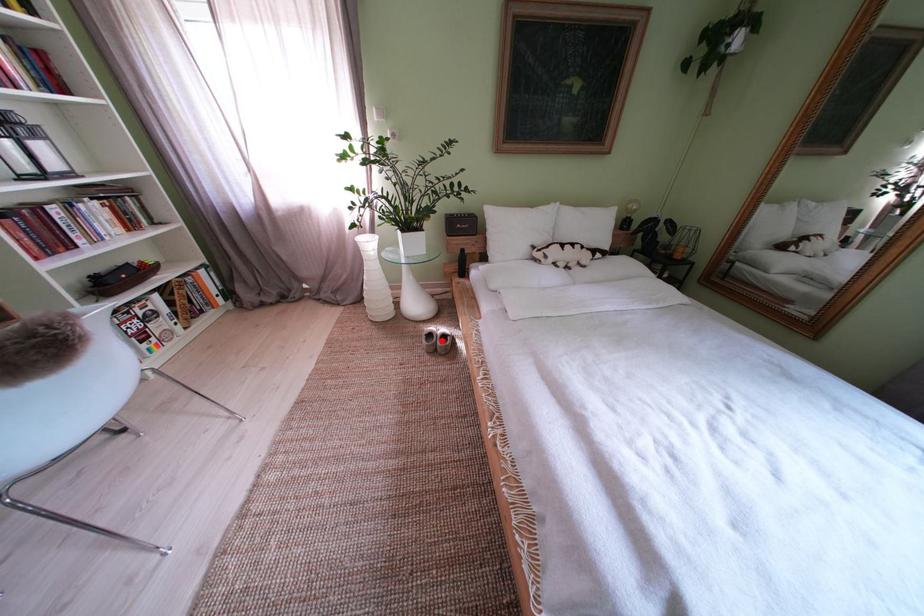
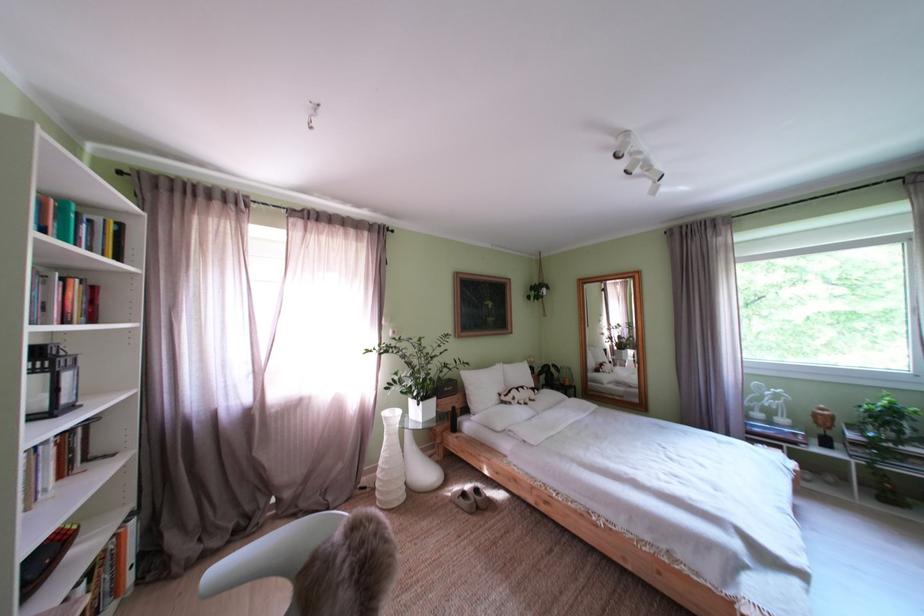
Locate, in the second image, the point that corresponds to the highlighted location in the first image.

(475, 500)